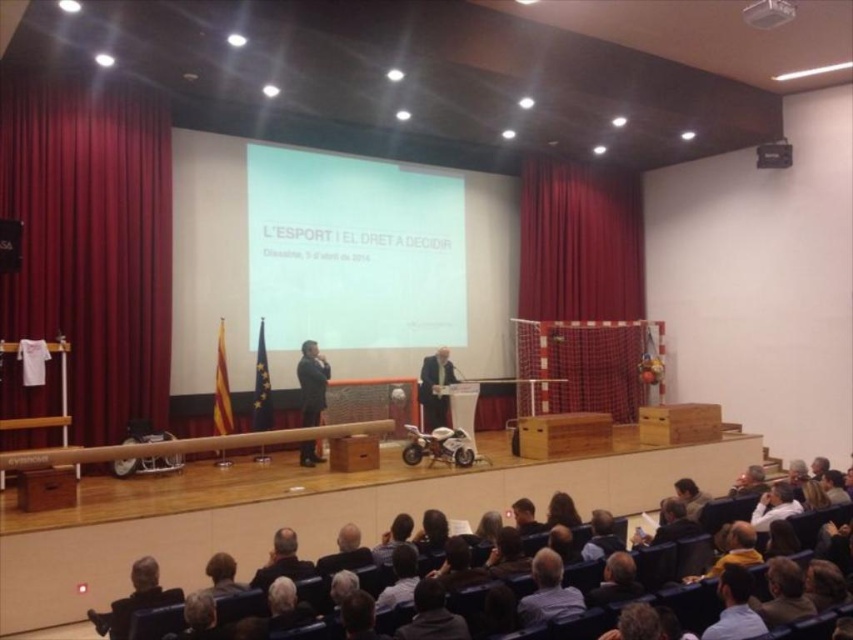
In the scene shown: You are an event organizer who needs to place a new banner on the stage. The banner requires a space that is not occupied by the white matte projection screen at center. Based on the scene description, where should you place the banner to ensure it does not overlap with the screen?

The white matte projection screen at center is located at point (352, 252), so you should place the banner in an area of the stage that does not include these coordinates to avoid overlapping with the screen.

You are an event organizer setting up for a presentation. You need to place a banner that is 3 meters wide. The banner must be placed on the stage where there is enough space. Which object between the white matte projection screen at center and the curtain at center would allow the banner to fit horizontally without overlapping?

The white matte projection screen at center has a larger width than the curtain at center, so placing the 3 meter wide banner on the white matte projection screen at center would provide enough space horizontally without overlapping.